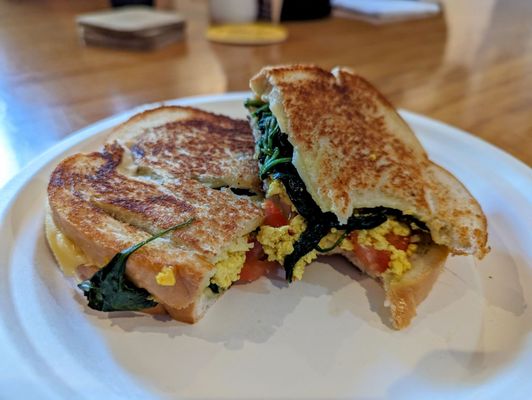
You are a GUI agent. You are given a task and a screenshot of the screen. Output one action in this format:
    pyautogui.click(x=<x>, y=<y>)
    Task: Click on the square coaster
    
    Given the screenshot: What is the action you would take?
    pyautogui.click(x=108, y=38)